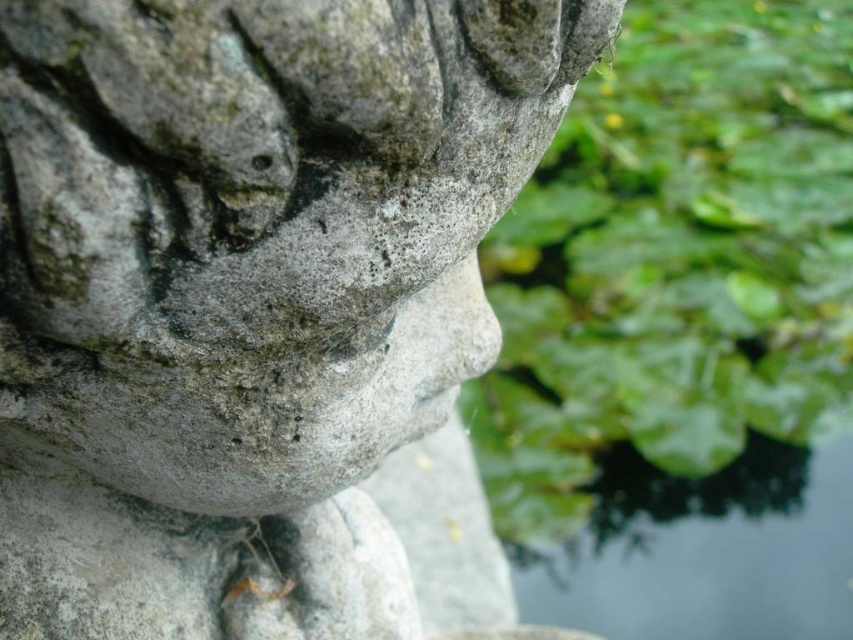
Question: Does gray stone statue at center have a smaller size compared to transparent water at lower right?

Choices:
 (A) yes
 (B) no

Answer: (B)

Question: Which object appears farthest from the camera in this image?

Choices:
 (A) gray stone statue at center
 (B) transparent water at lower right

Answer: (B)

Question: Can you confirm if gray stone statue at center is positioned to the right of transparent water at lower right?

Choices:
 (A) yes
 (B) no

Answer: (B)

Question: Among these points, which one is farthest from the camera?

Choices:
 (A) (262, 509)
 (B) (728, 499)

Answer: (B)

Question: Does gray stone statue at center have a smaller size compared to transparent water at lower right?

Choices:
 (A) yes
 (B) no

Answer: (B)

Question: Which of the following is the farthest from the observer?

Choices:
 (A) gray stone statue at center
 (B) transparent water at lower right

Answer: (B)